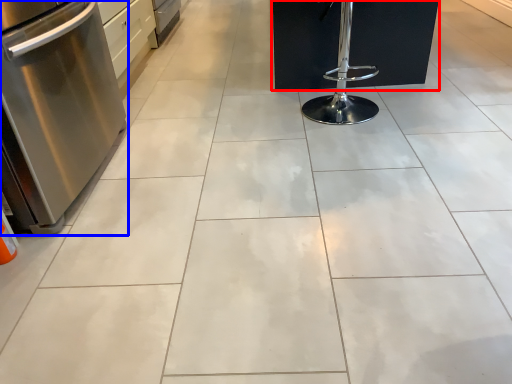
Question: Which point is closer to the camera, furniture (highlighted by a red box) or kitchen appliance (highlighted by a blue box)?

Choices:
 (A) furniture
 (B) kitchen appliance

Answer: (B)